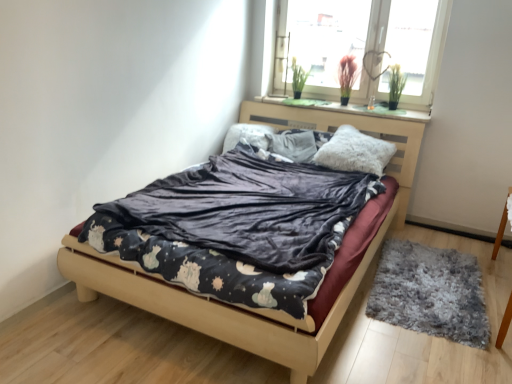
Question: From the image's perspective, is fluffy white pillow at center, the second pillow from the left, beneath fluffy white pillow at center, the 1th pillow viewed from the left?

Choices:
 (A) no
 (B) yes

Answer: (B)

Question: Could you tell me if fluffy white pillow at center, the second pillow from the left, is facing fluffy white pillow at center, the 1th pillow viewed from the left?

Choices:
 (A) no
 (B) yes

Answer: (A)

Question: Can fluffy white pillow at center, the 1th pillow viewed from the left, be found inside fluffy white pillow at center, which is the 2th pillow in right-to-left order?

Choices:
 (A) no
 (B) yes

Answer: (A)

Question: Is fluffy white pillow at center, which is the 2th pillow in right-to-left order, oriented away from fluffy white pillow at center, the 1th pillow viewed from the left?

Choices:
 (A) yes
 (B) no

Answer: (B)

Question: Considering the relative positions of fluffy white pillow at center, which is the 2th pillow in right-to-left order, and fluffy white pillow at center, the 1th pillow viewed from the left, in the image provided, is fluffy white pillow at center, which is the 2th pillow in right-to-left order, to the right of fluffy white pillow at center, the 1th pillow viewed from the left, from the viewer's perspective?

Choices:
 (A) yes
 (B) no

Answer: (A)

Question: From a real-world perspective, is fluffy white pillow at center, the second pillow from the left, over fluffy white pillow at center, arranged as the third pillow when viewed from the right?

Choices:
 (A) no
 (B) yes

Answer: (B)

Question: Is white fluffy pillow at center, the third pillow when ordered from left to right, not near fluffy white pillow at center, which is the 2th pillow in right-to-left order?

Choices:
 (A) yes
 (B) no

Answer: (B)

Question: Considering the relative sizes of white fluffy pillow at center, which appears as the 1th pillow when viewed from the right, and fluffy white pillow at center, which is the 2th pillow in right-to-left order, in the image provided, is white fluffy pillow at center, which appears as the 1th pillow when viewed from the right, wider than fluffy white pillow at center, which is the 2th pillow in right-to-left order,?

Choices:
 (A) no
 (B) yes

Answer: (B)

Question: From a real-world perspective, is white fluffy pillow at center, the third pillow when ordered from left to right, on fluffy white pillow at center, the second pillow from the left?

Choices:
 (A) no
 (B) yes

Answer: (B)

Question: Considering the relative sizes of white fluffy pillow at center, the third pillow when ordered from left to right, and fluffy white pillow at center, the second pillow from the left, in the image provided, is white fluffy pillow at center, the third pillow when ordered from left to right, smaller than fluffy white pillow at center, the second pillow from the left,?

Choices:
 (A) no
 (B) yes

Answer: (A)

Question: Is white fluffy pillow at center, which appears as the 1th pillow when viewed from the right, further to camera compared to fluffy white pillow at center, which is the 2th pillow in right-to-left order?

Choices:
 (A) no
 (B) yes

Answer: (A)

Question: Is fluffy white pillow at center, the second pillow from the left, a part of white fluffy pillow at center, the third pillow when ordered from left to right?

Choices:
 (A) no
 (B) yes

Answer: (A)

Question: Is white fluffy pillow at center, which appears as the 1th pillow when viewed from the right, positioned in front of gray shaggy rug at lower right?

Choices:
 (A) yes
 (B) no

Answer: (B)